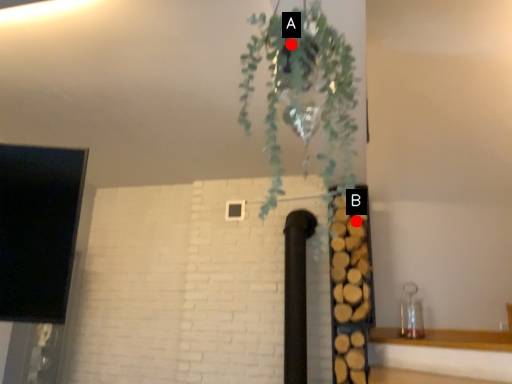
Question: Two points are circled on the image, labeled by A and B beside each circle. Among these points, which one is nearest to the camera?

Choices:
 (A) A is closer
 (B) B is closer

Answer: (A)